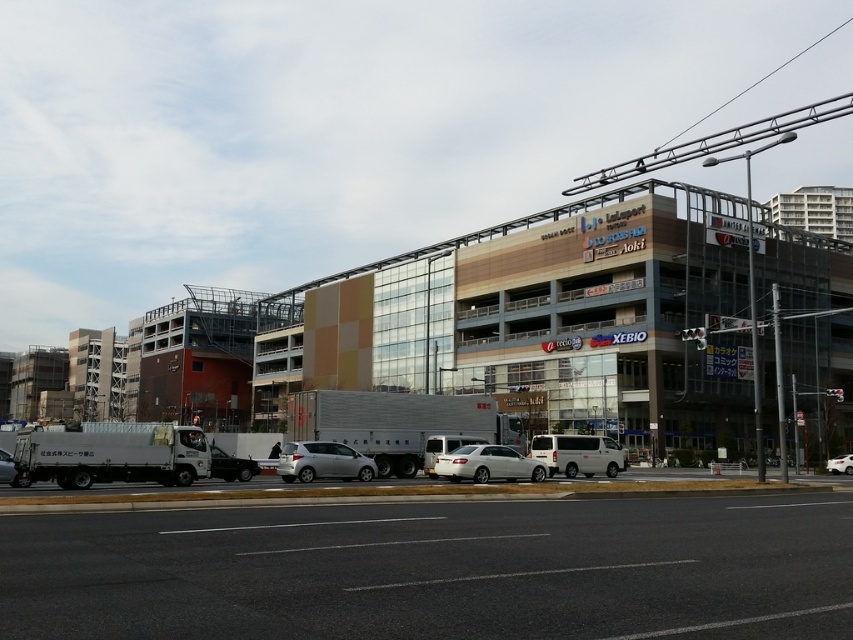
Does silver metallic truck at center have a lesser width compared to white matte truck at lower left?

No.

What do you see at coordinates (399, 424) in the screenshot? The width and height of the screenshot is (853, 640). I see `silver metallic truck at center` at bounding box center [399, 424].

Identify the location of silver metallic truck at center. The width and height of the screenshot is (853, 640). (399, 424).

You are a GUI agent. You are given a task and a screenshot of the screen. Output one action in this format:
    pyautogui.click(x=<x>, y=<y>)
    Task: Click on the white matte van at center
    
    Given the screenshot: What is the action you would take?
    pyautogui.click(x=577, y=454)

Consider the image. Can you confirm if satin black sedan at center is shorter than white glossy sedan at center?

No.

Is point (218, 465) positioned before point (849, 467)?

Yes, point (218, 465) is in front of point (849, 467).

This screenshot has height=640, width=853. Describe the element at coordinates (231, 465) in the screenshot. I see `satin black sedan at center` at that location.

Locate an element on the screen. satin black sedan at center is located at coordinates (231, 465).